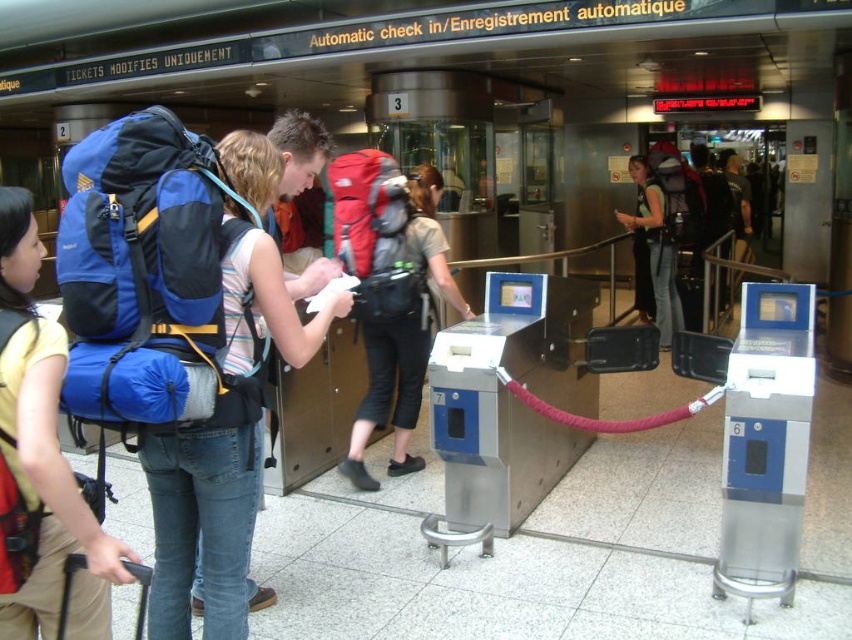
Based on the photo, you are a traveler at an airport checkin area. You have two backpacks with you, the blue fabric backpack at center and the matte red backpack at center. You need to place one on the luggage scale to weigh it. Which backpack should you choose if you want to check if it exceeds the weight limit?

The blue fabric backpack at center is bigger than the matte red backpack at center, so it is more likely to exceed the weight limit and should be weighed first.

You are a traveler at the airport checkin area. You see a matte blue backpack at left and a matte red backpack at center. Which backpack is shorter in height?

The matte blue backpack at left is shorter in height than the matte red backpack at center.

You are a traveler at the airport checkin area. You have two backpacks with you, the matte blue backpack at left and the matte red backpack at center. You need to place both on the scale provided to check their weight. The scale can only hold one backpack at a time. Which backpack should you place first to minimize the chance of the scale breaking?

The matte blue backpack at left is smaller than the matte red backpack at center, so placing the matte blue backpack at left first would minimize the chance of the scale breaking since it is lighter.